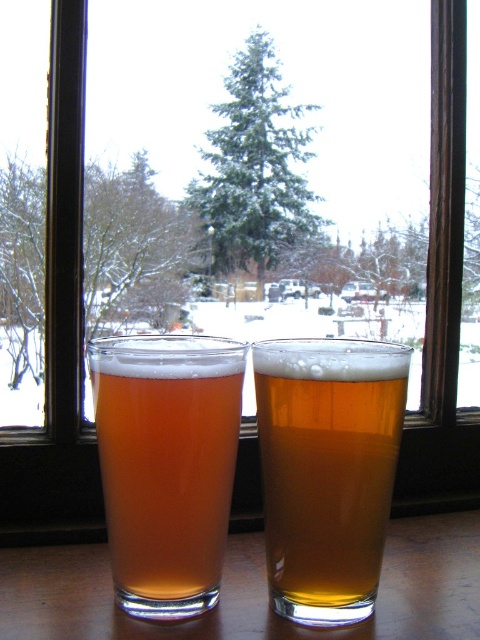
Question: Does translucent amber glass at center appear on the right side of transparent glass at center?

Choices:
 (A) yes
 (B) no

Answer: (B)

Question: Estimate the real-world distances between objects in this image. Which object is closer to the translucent amber glass at center?

Choices:
 (A) golden glass beer at center
 (B) transparent glass at center

Answer: (A)

Question: Among these objects, which one is farthest from the camera?

Choices:
 (A) golden glass beer at center
 (B) transparent glass at center

Answer: (B)

Question: Where is golden glass beer at center located in relation to transparent glass at center in the image?

Choices:
 (A) below
 (B) above

Answer: (B)

Question: Can you confirm if golden glass beer at center is positioned below transparent glass at center?

Choices:
 (A) no
 (B) yes

Answer: (A)

Question: Which is farther from the translucent amber glass at center?

Choices:
 (A) transparent glass at center
 (B) golden glass beer at center

Answer: (A)